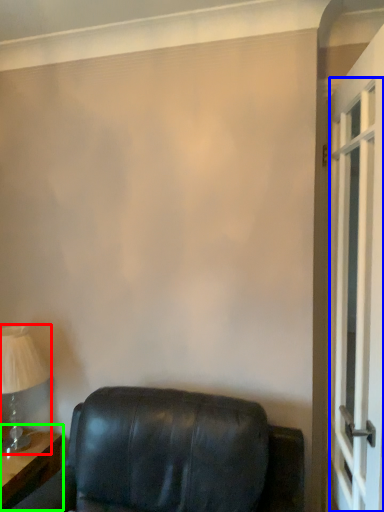
Question: Estimate the real-world distances between objects in this image. Which object is closer to table lamp (highlighted by a red box), screen door (highlighted by a blue box) or table (highlighted by a green box)?

Choices:
 (A) screen door
 (B) table

Answer: (B)